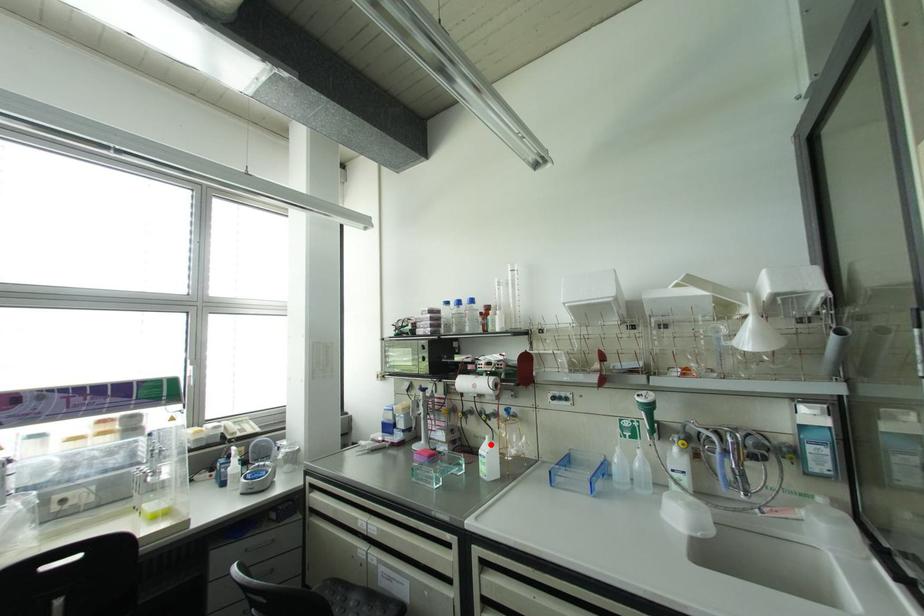
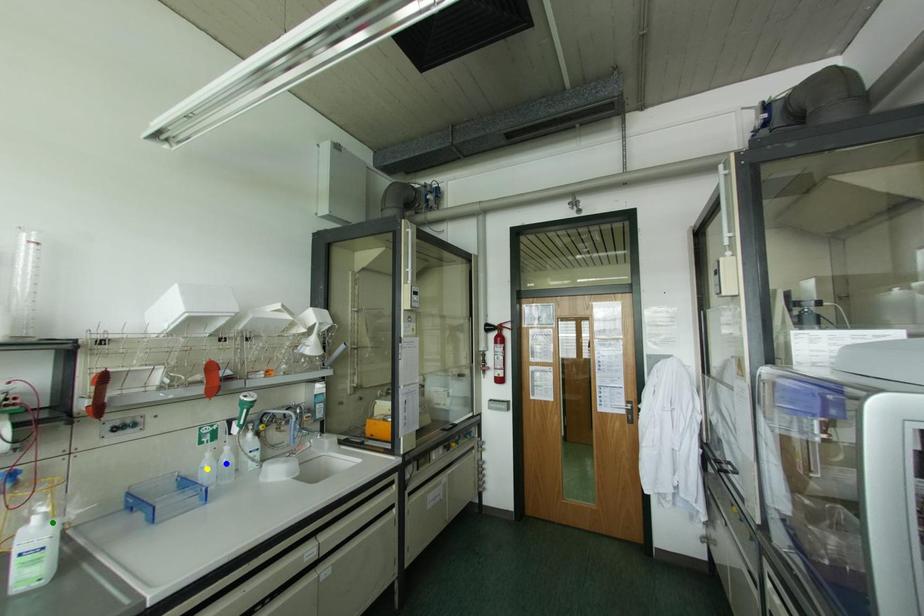
Question: I am providing you with two images of the same scene from different viewpoints. A red point is marked on the first image. You are given multiple points on the second image. Which spot in image 2 lines up with the point in image 1?

Choices:
 (A) yellow point
 (B) blue point
 (C) green point

Answer: (C)